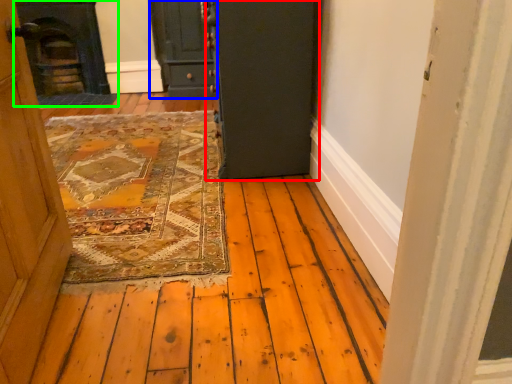
Question: Estimate the real-world distances between objects in this image. Which object is farther from door (highlighted by a red box), door (highlighted by a blue box) or fireplace (highlighted by a green box)?

Choices:
 (A) door
 (B) fireplace

Answer: (B)